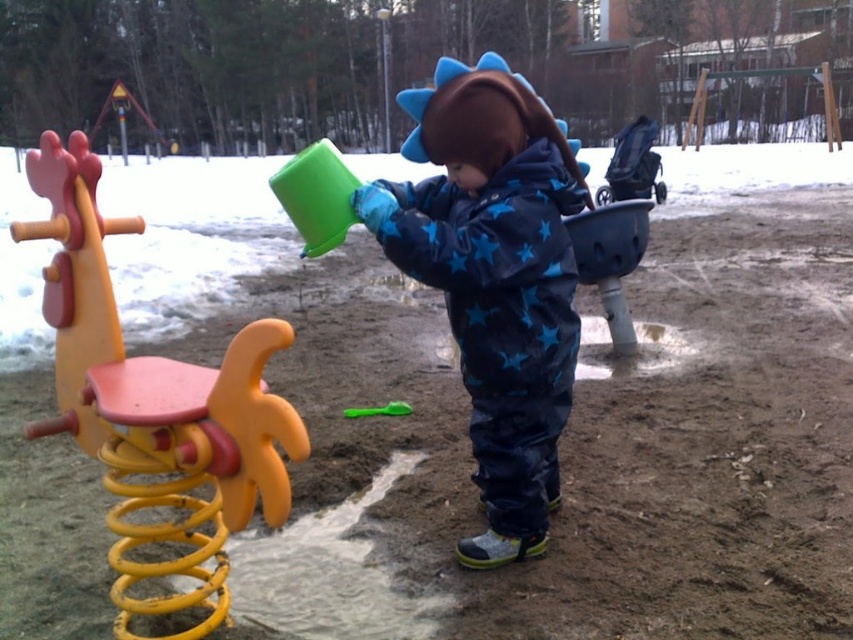
Between blue star-patterned snowsuit at center and green plastic spoon at center, which one has more height?

blue star-patterned snowsuit at center

Which is in front, point (531, 284) or point (405, 413)?

Point (531, 284) is in front.

Locate an element on the screen. The width and height of the screenshot is (853, 640). blue star-patterned snowsuit at center is located at coordinates (494, 278).

From the picture: Who is lower down, yellow plastic spring at left or green plastic spoon at center?

green plastic spoon at center

You are a GUI agent. You are given a task and a screenshot of the screen. Output one action in this format:
    pyautogui.click(x=<x>, y=<y>)
    Task: Click on the yellow plastic spring at left
    
    Given the screenshot: What is the action you would take?
    pyautogui.click(x=154, y=403)

This screenshot has width=853, height=640. What are the coordinates of `yellow plastic spring at left` in the screenshot? It's located at point(154,403).

Looking at this image, can you confirm if blue star-patterned snowsuit at center is thinner than yellow plastic spring at left?

Correct, blue star-patterned snowsuit at center's width is less than yellow plastic spring at left's.

Describe the element at coordinates (494, 278) in the screenshot. I see `blue star-patterned snowsuit at center` at that location.

Where is `blue star-patterned snowsuit at center`? blue star-patterned snowsuit at center is located at coordinates (494, 278).